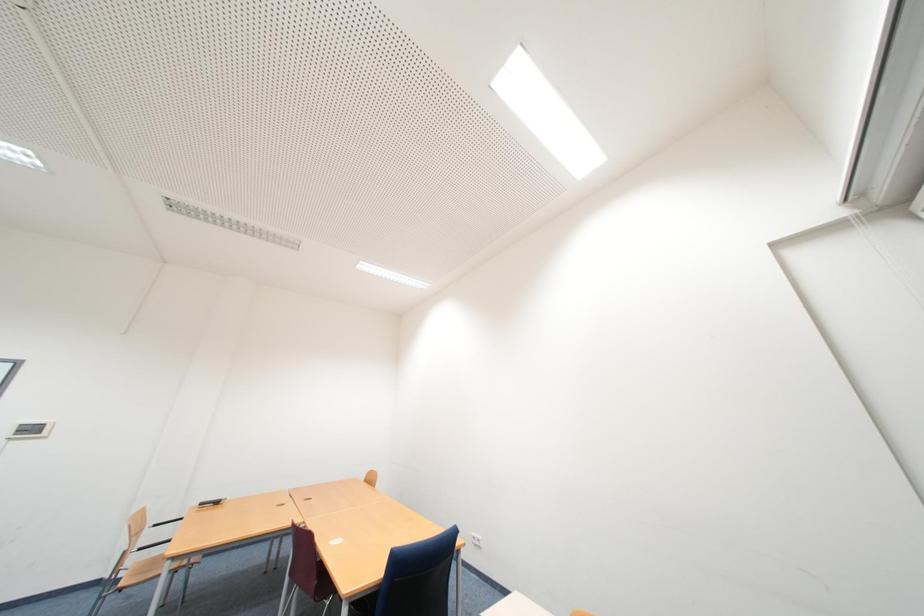
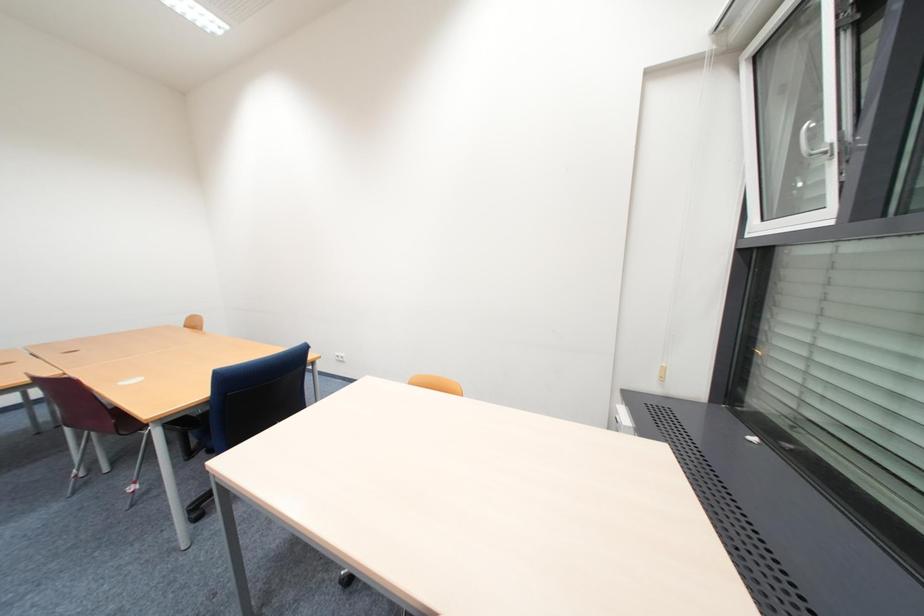
How did the camera likely rotate?

The camera rotated toward right-down.